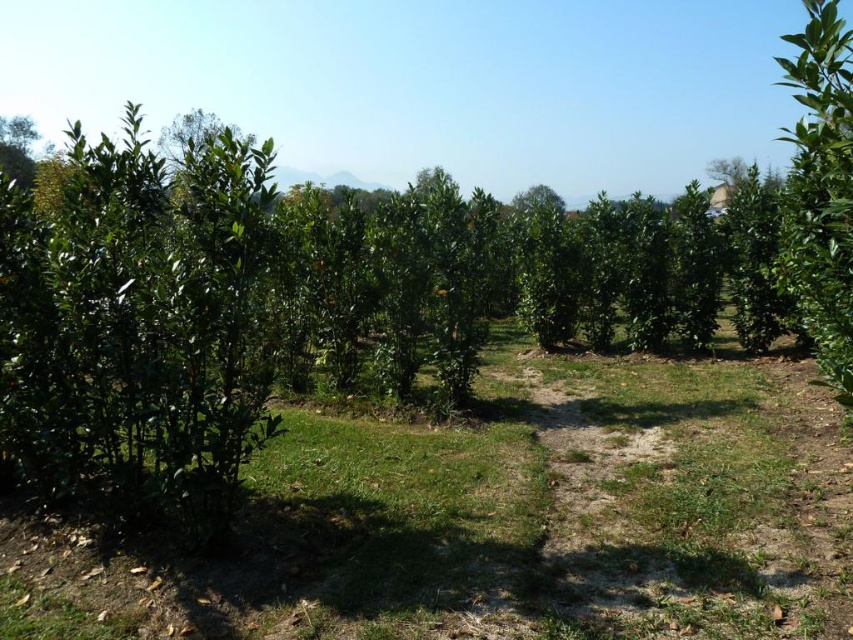
You are a gardener planning to water the green grass at center and the green leafy tree at upper right. Which object is positioned higher in the image?

The green leafy tree at upper right is positioned higher in the image than the green grass at center, which is located below it.

You are standing at the entrance of the orchard and want to find the green grass at center. According to the coordinates provided, where should you look relative to your position?

The green grass at center is located at coordinates point (498, 518), which means it is positioned to the right and slightly forward from your current position at the entrance.

You are standing at the origin point in the orchard and see two points marked in the image. Which point is closer to you, point [746,481] or point [718,164]?

Point [746,481] is in front of point [718,164], so it is closer to you.